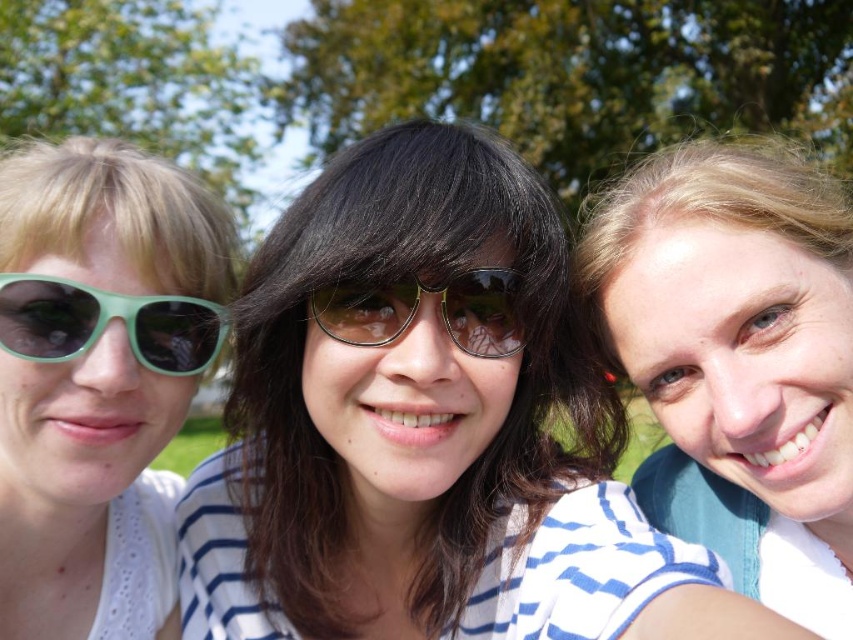
Does matte black sunglasses at center appear on the right side of metallic reflective sunglasses at center?

In fact, matte black sunglasses at center is to the left of metallic reflective sunglasses at center.

Can you confirm if matte black sunglasses at center is smaller than metallic reflective sunglasses at center?

No, matte black sunglasses at center is not smaller than metallic reflective sunglasses at center.

Does point (595, 456) come closer to viewer compared to point (473, 305)?

No, it is behind (473, 305).

I want to click on matte black sunglasses at center, so click(427, 428).

The width and height of the screenshot is (853, 640). I want to click on matte black sunglasses at center, so click(x=427, y=428).

Can you confirm if matte black sunglasses at center is bigger than white striped shirt at center?

Yes.

Is point (207, 579) positioned in front of point (837, 355)?

That is False.

You are a GUI agent. You are given a task and a screenshot of the screen. Output one action in this format:
    pyautogui.click(x=<x>, y=<y>)
    Task: Click on the matte black sunglasses at center
    Image resolution: width=853 pixels, height=640 pixels.
    Given the screenshot: What is the action you would take?
    pyautogui.click(x=427, y=428)

Which of these two, matte black sunglasses at center or green matte sunglasses at left, stands taller?

With more height is matte black sunglasses at center.

What do you see at coordinates (427, 428) in the screenshot? I see `matte black sunglasses at center` at bounding box center [427, 428].

Find the location of a particular element. The height and width of the screenshot is (640, 853). matte black sunglasses at center is located at coordinates click(427, 428).